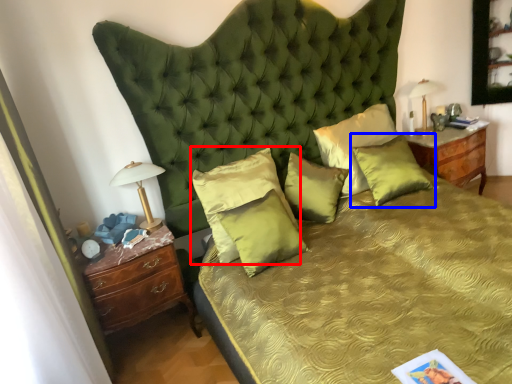
Question: Among these objects, which one is nearest to the camera, pillow (highlighted by a red box) or pillow (highlighted by a blue box)?

Choices:
 (A) pillow
 (B) pillow

Answer: (A)